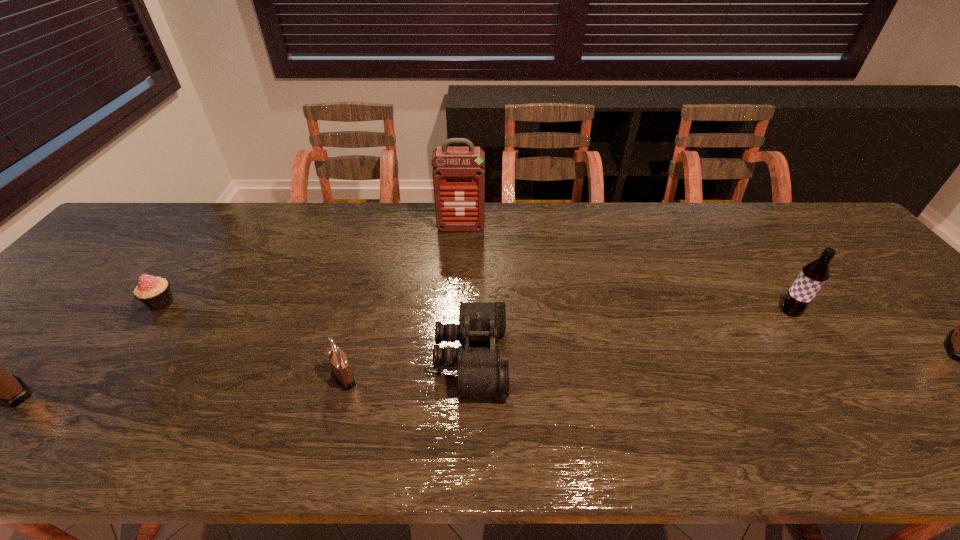
Locate an element on the screen. Image resolution: width=960 pixels, height=540 pixels. the second padlock from right to left is located at coordinates (343, 374).

Where is `the fifth tallest object`? Image resolution: width=960 pixels, height=540 pixels. the fifth tallest object is located at coordinates (343, 374).

Locate an element on the screen. The height and width of the screenshot is (540, 960). the first-aid kit is located at coordinates (458, 173).

Image resolution: width=960 pixels, height=540 pixels. I want to click on the farthest object, so click(x=458, y=173).

What are the coordinates of `root beer` in the screenshot? It's located at (812, 277).

The height and width of the screenshot is (540, 960). I want to click on cupcake, so click(x=154, y=292).

Image resolution: width=960 pixels, height=540 pixels. I want to click on binoculars, so click(480, 373).

I want to click on free space located 0.330m on the back of the third object from left to right, so click(x=373, y=266).

You are a GUI agent. You are given a task and a screenshot of the screen. Output one action in this format:
    pyautogui.click(x=<x>, y=<y>)
    Task: Click on the vacant space positioned on the front-facing side of the farthest object
    This screenshot has width=960, height=540.
    Given the screenshot: What is the action you would take?
    pyautogui.click(x=458, y=277)

This screenshot has width=960, height=540. Identify the location of vacant area located on the front of the root beer. (823, 359).